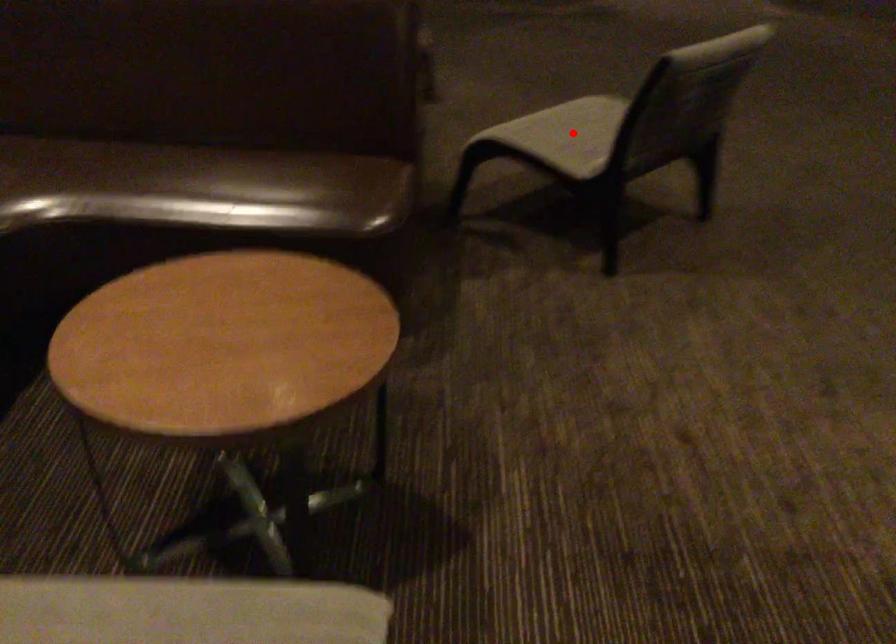
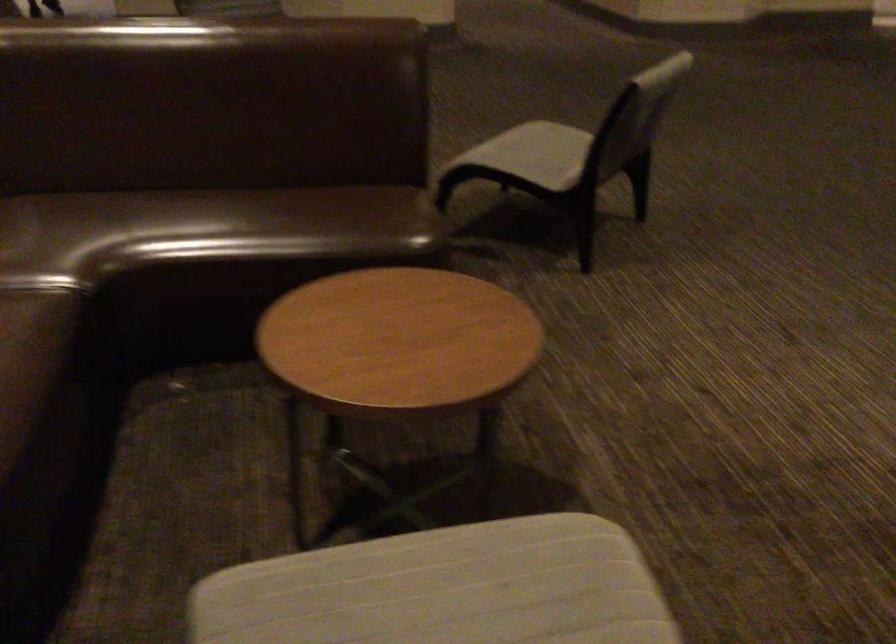
Question: I am providing you with two images of the same scene from different viewpoints. Image1 has a red point marked. In image2, the corresponding 3D location appears at what relative position? Reply with the corresponding letter.

Choices:
 (A) Closer
 (B) Farther

Answer: (B)